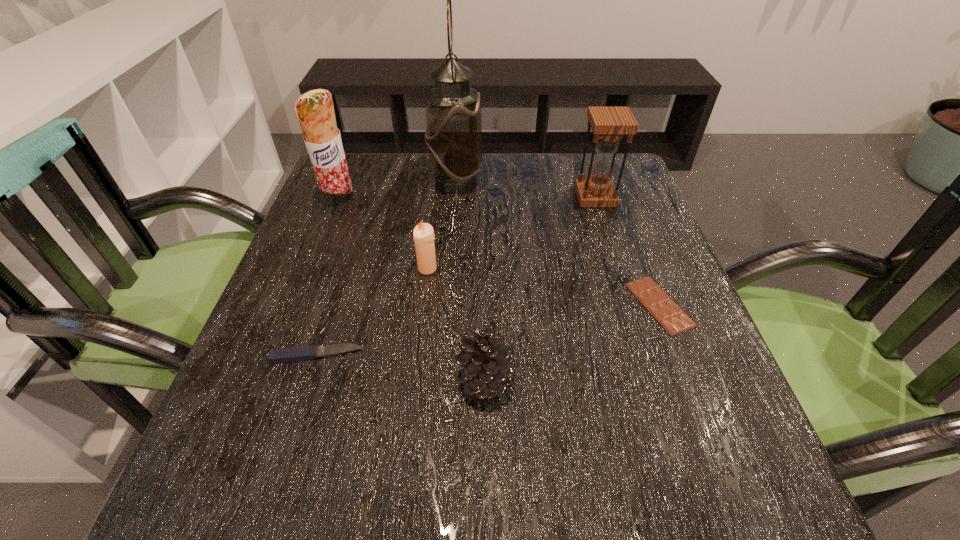
Where is `free space located 0.190m on the front of the third tallest object`? free space located 0.190m on the front of the third tallest object is located at coordinates (616, 263).

Where is `free space located 0.250m on the left of the candle`? free space located 0.250m on the left of the candle is located at coordinates (294, 268).

Where is `vacant space located on the front of the pinecone`? This screenshot has height=540, width=960. vacant space located on the front of the pinecone is located at coordinates (485, 465).

At what (x,y) coordinates should I click in order to perform the action: click on vacant space positioned 0.170m on the front of the steak knife. Please return your answer as a coordinate pair (x, y). This screenshot has width=960, height=540. Looking at the image, I should click on (281, 468).

Identify the location of vacant space situated 0.070m on the front of the chocolate bar. (684, 371).

Locate an element on the screen. The width and height of the screenshot is (960, 540). oil lamp present at the far edge is located at coordinates (454, 137).

This screenshot has width=960, height=540. I want to click on burrito that is at the far edge, so click(x=315, y=111).

Identify the location of hourglass that is at the far edge. This screenshot has height=540, width=960. (609, 124).

The width and height of the screenshot is (960, 540). In order to click on burrito positioned at the left edge in this screenshot , I will do `click(315, 111)`.

Identify the location of steak knife present at the left edge. (293, 354).